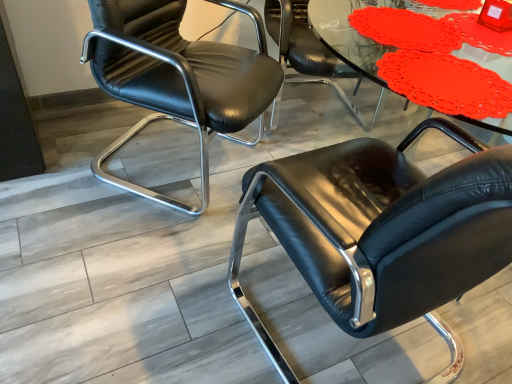
Question: Considering their positions, is matte plastic table at upper center located in front of or behind black leather chair at center, which is counted as the second chair, starting from the right?

Choices:
 (A) front
 (B) behind

Answer: (A)

Question: From a real-world perspective, is matte plastic table at upper center positioned above or below black leather chair at center, the second chair when ordered from left to right?

Choices:
 (A) below
 (B) above

Answer: (B)

Question: Estimate the real-world distances between objects in this image. Which object is farther from the black leather chair at left, placed as the 1th chair when sorted from left to right?

Choices:
 (A) black leather chair at center, the first chair positioned from the right
 (B) matte plastic table at upper center
 (C) black leather chair at center, the second chair when ordered from left to right

Answer: (B)

Question: Estimate the real-world distances between objects in this image. Which object is closer to the black leather chair at left, marked as the 3th chair in a right-to-left arrangement?

Choices:
 (A) matte plastic table at upper center
 (B) black leather chair at center, the second chair when ordered from left to right
 (C) black leather chair at center, the first chair positioned from the right

Answer: (B)